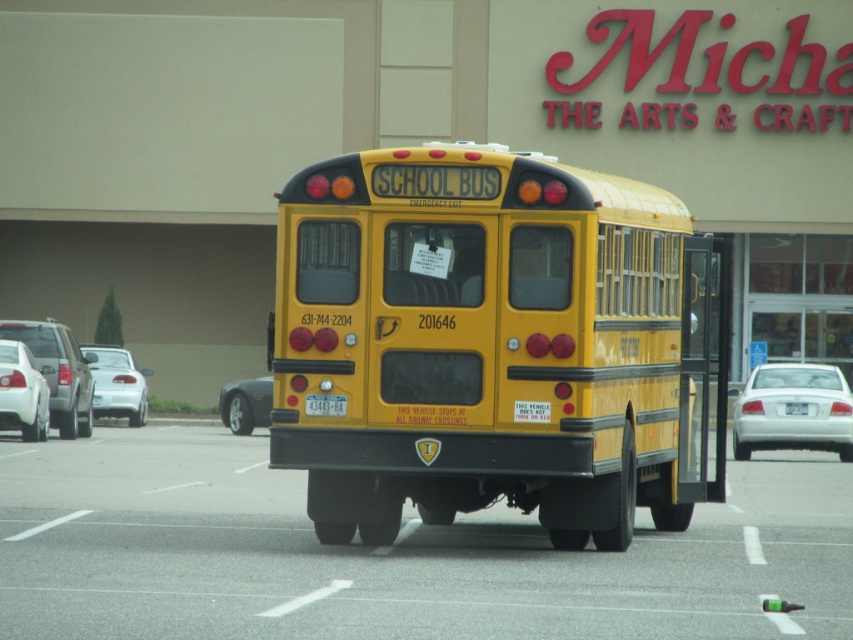
You are a driver approaching the yellow school bus from behind. You see a white matte car at left and a yellow matte license plate at center. Which object is positioned lower in the scene?

The white matte car at left is located below the yellow matte license plate at center, so it is positioned lower in the scene.

You are a pedestrian standing at the edge of the parking lot. You see the yellow matte school bus at center and the shiny black car at lower left. Which vehicle is closer to you?

The yellow matte school bus at center is closer to you because it is in front of the shiny black car at lower left.

You are a parking attendant trying to fit a new car into a parking space next to the white matte car at left and the yellow matte license plate at center. Based on their widths, which vehicle should you place first to maximize space efficiency?

The white matte car at left has a larger width than the yellow matte license plate at center. To maximize space efficiency, you should place the white matte car at left first, as it requires more space, followed by the yellow matte license plate at center.